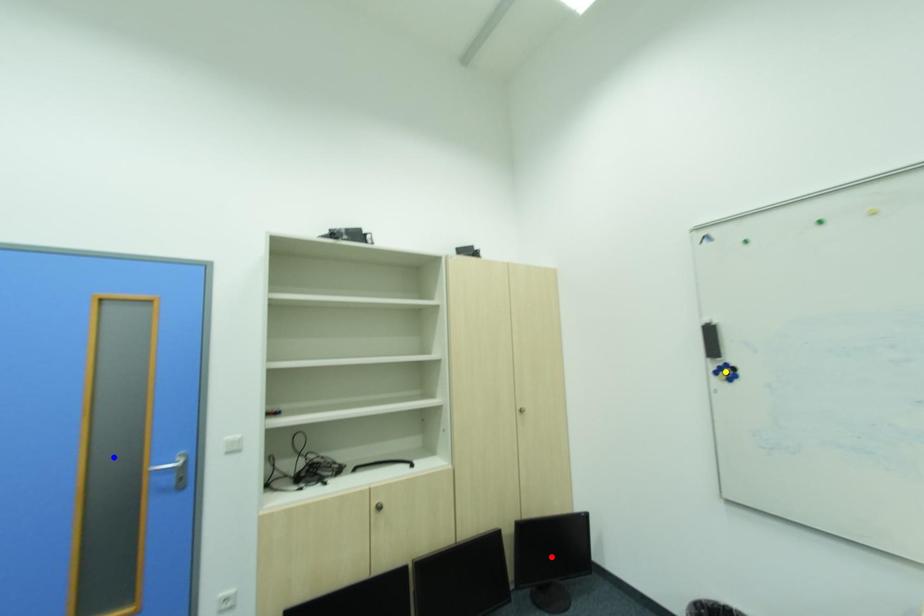
Order these from nearest to farthest:
yellow point
red point
blue point

blue point, yellow point, red point